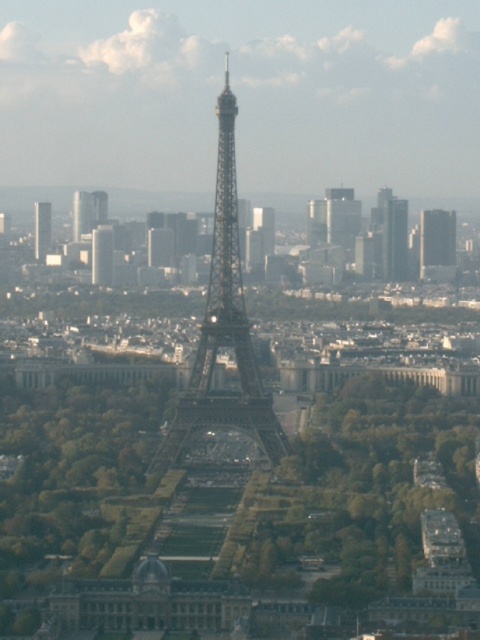
Does smooth glass skyscraper at right have a greater height compared to matte black tower at left?

Correct, smooth glass skyscraper at right is much taller as matte black tower at left.

The height and width of the screenshot is (640, 480). What are the coordinates of `smooth glass skyscraper at right` in the screenshot? It's located at (437, 244).

Does point (450, 224) come closer to viewer compared to point (38, 257)?

No.

Identify the location of smooth glass skyscraper at right. The width and height of the screenshot is (480, 640). (437, 244).

Between metallic structure at center and matte black tower at left, which one appears on the right side from the viewer's perspective?

metallic structure at center

Can you confirm if metallic structure at center is thinner than matte black tower at left?

Incorrect, metallic structure at center's width is not less than matte black tower at left's.

Does point (228, 330) come in front of point (50, 218)?

Yes.

Locate an element on the screen. This screenshot has width=480, height=640. metallic structure at center is located at coordinates (223, 330).

Is point (248, 406) farther from viewer compared to point (111, 280)?

No, (248, 406) is in front of (111, 280).

The width and height of the screenshot is (480, 640). Describe the element at coordinates (223, 330) in the screenshot. I see `metallic structure at center` at that location.

Identify the location of metallic structure at center. The width and height of the screenshot is (480, 640). (223, 330).